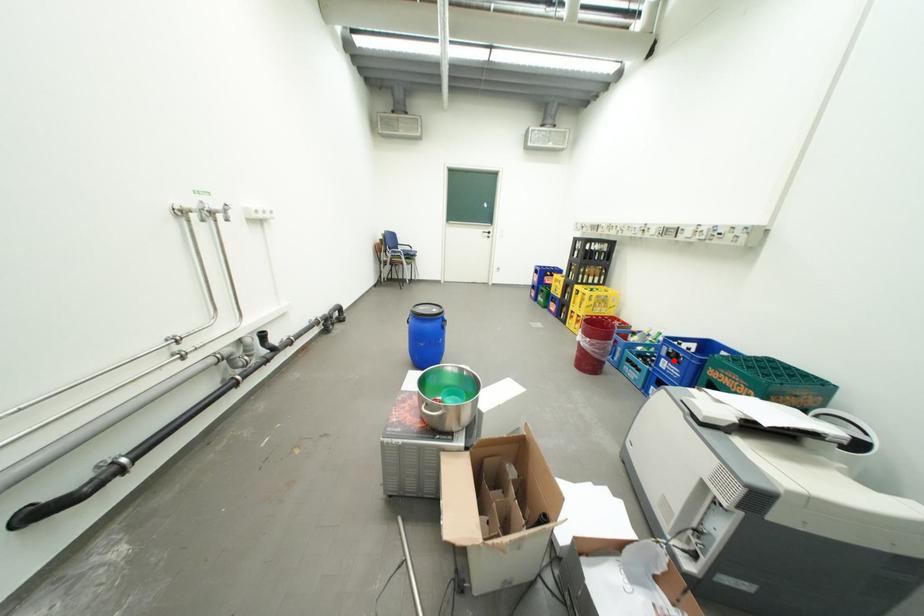
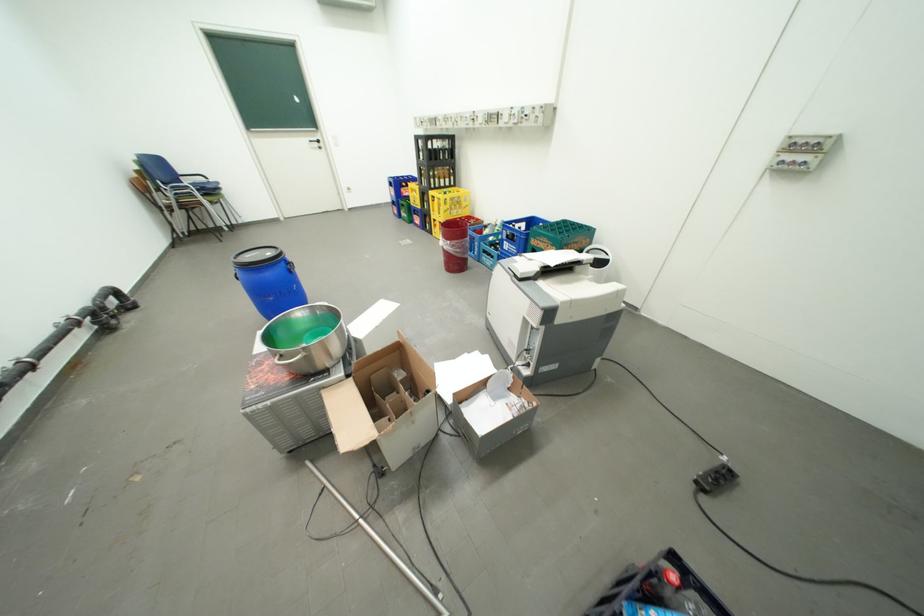
Question: I am providing you with two images of the same scene from different viewpoints. A red point is shown in image1. For the corresponding object point in image2, is it positioned nearer or farther from the camera?

Choices:
 (A) Nearer
 (B) Farther

Answer: (B)